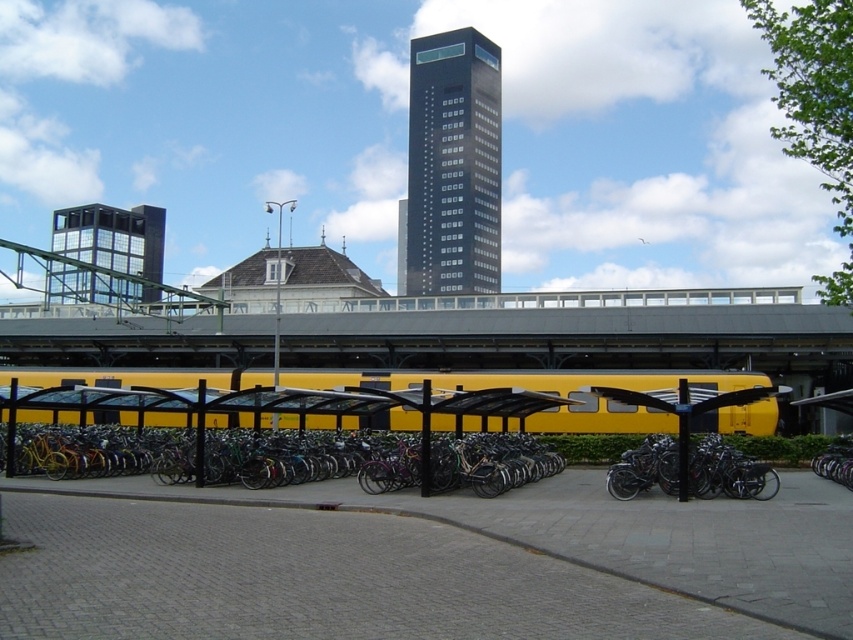
Question: Among these points, which one is nearest to the camera?

Choices:
 (A) (616, 548)
 (B) (489, 282)

Answer: (A)

Question: Is gray concrete pavement at lower center bigger than black glass tower at upper center?

Choices:
 (A) yes
 (B) no

Answer: (B)

Question: Is gray concrete pavement at lower center closer to the viewer compared to glassy reflective tower at upper left?

Choices:
 (A) no
 (B) yes

Answer: (B)

Question: Does black glass tower at upper center have a smaller size compared to glassy reflective tower at upper left?

Choices:
 (A) yes
 (B) no

Answer: (A)

Question: Which object appears farthest from the camera in this image?

Choices:
 (A) gray concrete pavement at lower center
 (B) glassy reflective tower at upper left
 (C) black glass tower at upper center

Answer: (C)

Question: Among these objects, which one is nearest to the camera?

Choices:
 (A) gray concrete pavement at lower center
 (B) black glass tower at upper center
 (C) glassy reflective tower at upper left

Answer: (A)